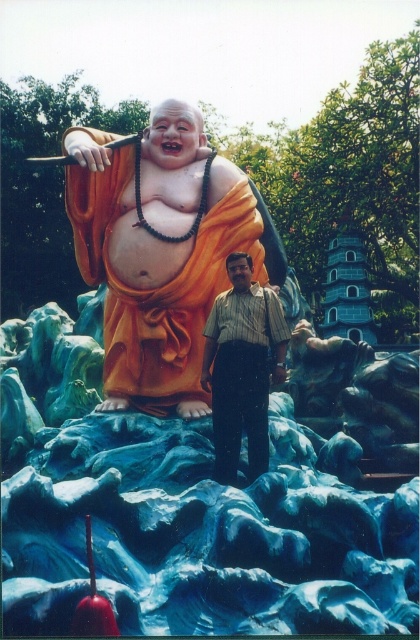
Question: Can you confirm if orange matte statue at center is wider than striped shirt at center?

Choices:
 (A) no
 (B) yes

Answer: (B)

Question: Is orange matte statue at center behind striped shirt at center?

Choices:
 (A) no
 (B) yes

Answer: (B)

Question: Which object appears closest to the camera in this image?

Choices:
 (A) striped shirt at center
 (B) orange matte statue at center

Answer: (A)

Question: Does orange matte statue at center come behind striped shirt at center?

Choices:
 (A) yes
 (B) no

Answer: (A)